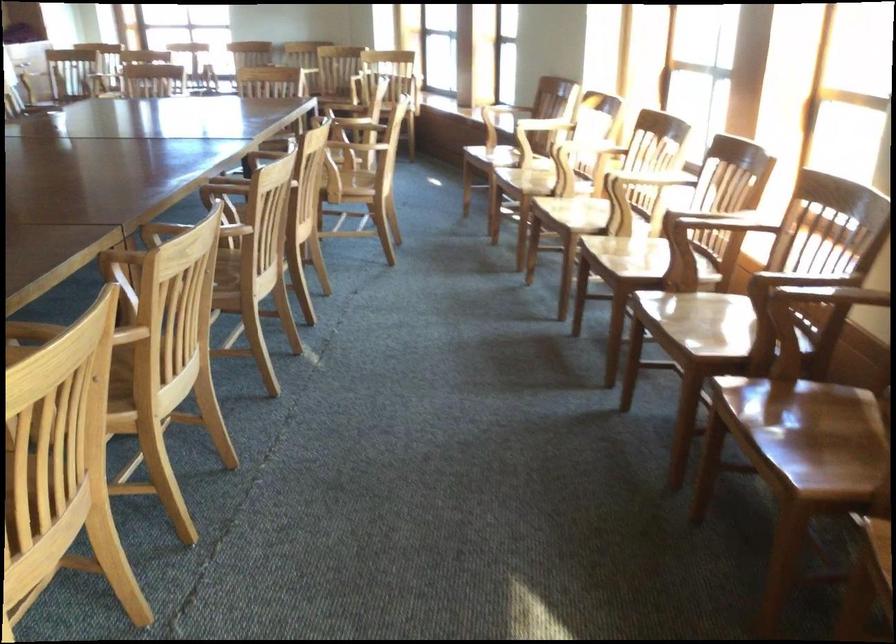
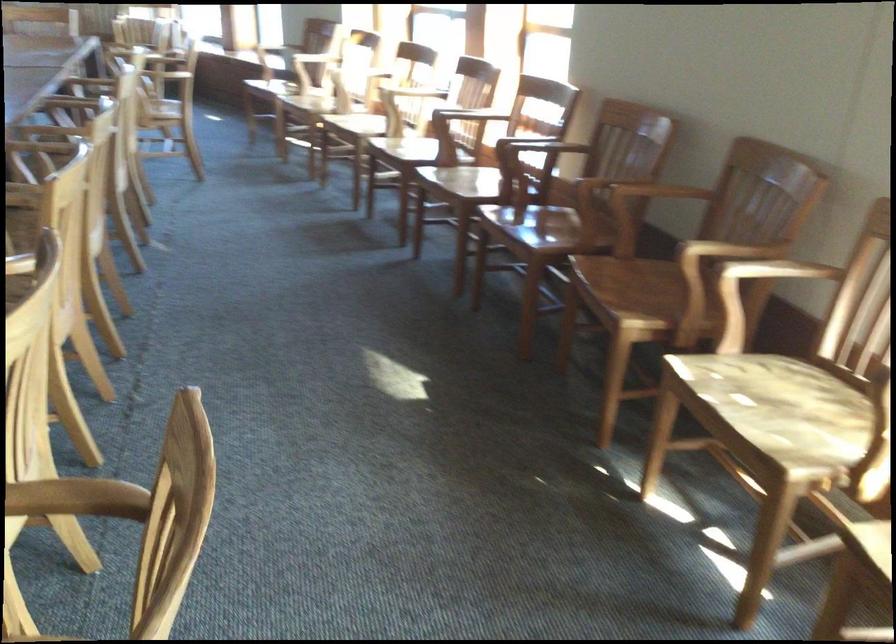
The point at (705, 322) is marked in the first image. Where is the corresponding point in the second image?

(470, 180)